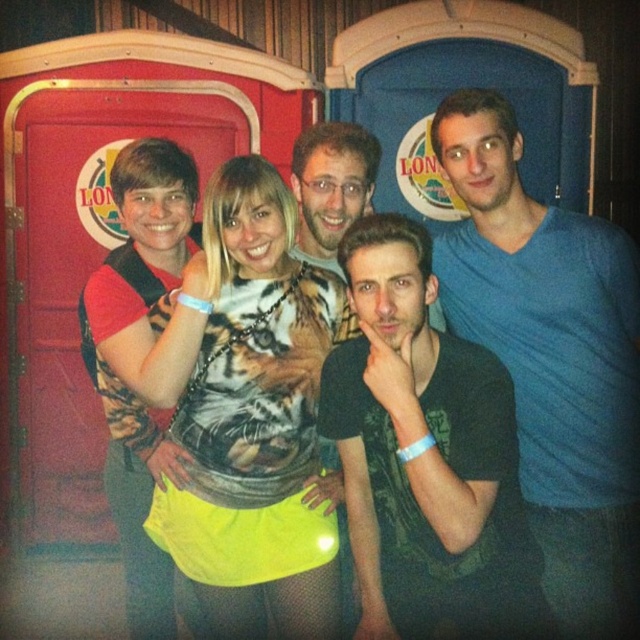
You are standing in front of the portable toilets and want to find the blue cotton shirt at center. Based on the coordinates provided, where should you look relative to the toilets?

The blue cotton shirt at center is located at point 0.558 along the horizontal axis and 0.863 along the vertical axis, meaning it is positioned to the right and slightly above the center point of the image. Since the toilets are part of the scene, you should look towards the right side and slightly above the middle area near the toilets to find the blue cotton shirt at center.

You are standing at the position of point (368, 385) and want to move to the portable toilet painted blue. The blue toilet is located at point (586, 486). Can you walk directly to the blue toilet without going around any obstacles?

Point (586, 486) is behind point (368, 385), so you cannot walk directly to the blue toilet at point (586, 486) without going around obstacles since it is behind your current position.